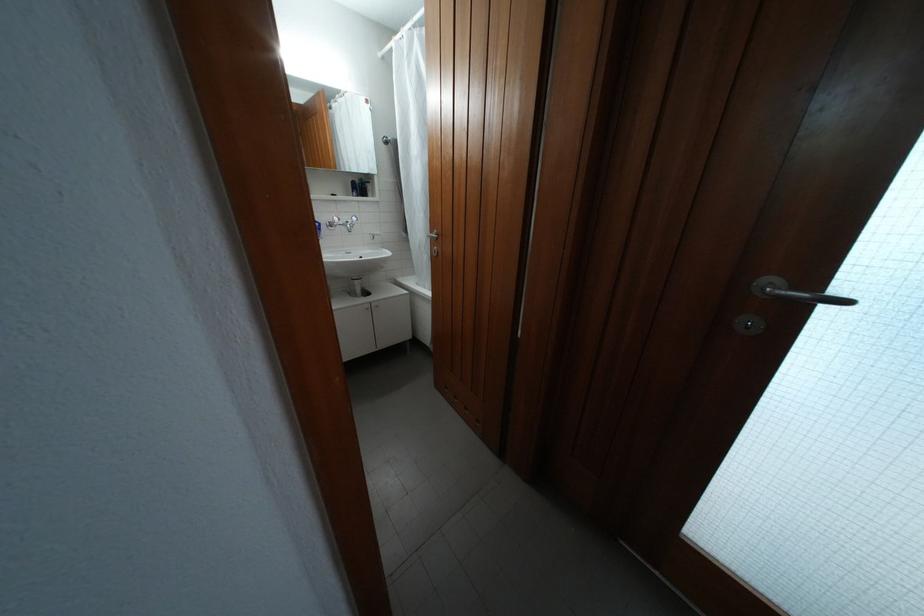
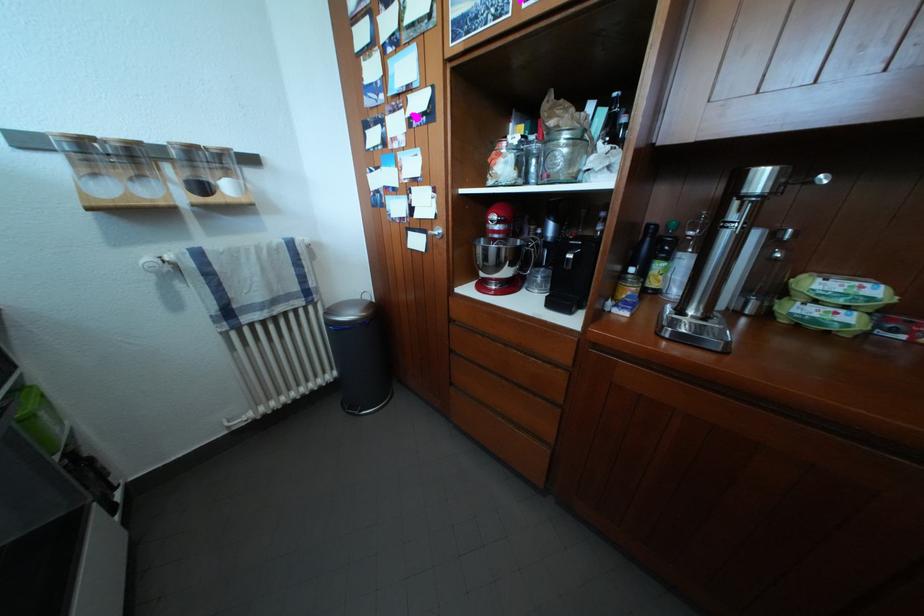
Consider the image. In a continuous first-person perspective shot, in which direction is the camera moving?

The movement direction of the cameraman is left, backward.